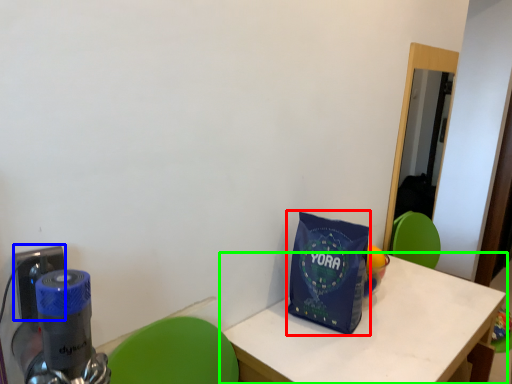
Question: Estimate the real-world distances between objects in this image. Which object is closer to tote bag (highlighted by a red box), electric outlet (highlighted by a blue box) or table (highlighted by a green box)?

Choices:
 (A) electric outlet
 (B) table

Answer: (B)